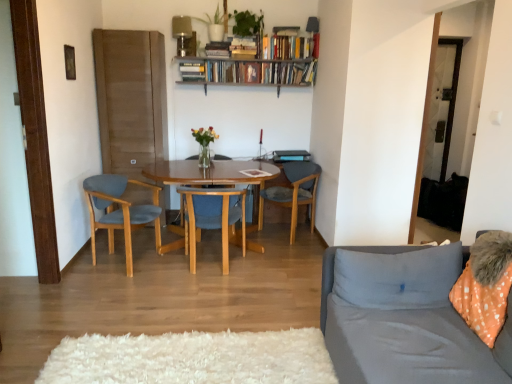
Describe the element at coordinates (397, 277) in the screenshot. The image size is (512, 384). I see `gray fabric pillow at right` at that location.

What do you see at coordinates (213, 217) in the screenshot?
I see `blue fabric chair at center, the second chair positioned from the left` at bounding box center [213, 217].

Describe the element at coordinates (215, 25) in the screenshot. I see `green matte plant at upper center, the first houseplant in the left-to-right sequence` at that location.

What do you see at coordinates (181, 32) in the screenshot? This screenshot has height=384, width=512. I see `metallic silver lamp at upper center, which is the 2th lamp from right to left` at bounding box center [181, 32].

The width and height of the screenshot is (512, 384). What do you see at coordinates (120, 211) in the screenshot?
I see `matte blue chair at left, the third chair in the right-to-left sequence` at bounding box center [120, 211].

Where is `hardcover books at upper center, which appears as the 1th book when viewed from the right`? Image resolution: width=512 pixels, height=384 pixels. hardcover books at upper center, which appears as the 1th book when viewed from the right is located at coordinates (287, 47).

Relative to gray fabric pillow at right, is green matte plant at upper center, the 1th houseplant when ordered from right to left, in front or behind?

Clearly, green matte plant at upper center, the 1th houseplant when ordered from right to left, is behind gray fabric pillow at right.

In the scene shown: From a real-world perspective, between green matte plant at upper center, the 2th houseplant positioned from the left, and gray fabric pillow at right, who is vertically lower?

gray fabric pillow at right, from a real-world perspective.

Considering the relative positions of green matte plant at upper center, the 2th houseplant positioned from the left, and gray fabric pillow at right in the image provided, is green matte plant at upper center, the 2th houseplant positioned from the left, to the left or to the right of gray fabric pillow at right?

green matte plant at upper center, the 2th houseplant positioned from the left, is to the left of gray fabric pillow at right.

Is point (247, 24) closer or farther from the camera than point (456, 278)?

Point (247, 24) appears to be farther away from the viewer than point (456, 278).

From a real-world perspective, is green matte plant at upper center, the first houseplant in the left-to-right sequence, positioned above or below metallic silver lamp at upper center, which is the 2th lamp from right to left?

Clearly, from a real-world perspective, green matte plant at upper center, the first houseplant in the left-to-right sequence, is above metallic silver lamp at upper center, which is the 2th lamp from right to left.

Is point (201, 19) less distant than point (183, 38)?

No, it is behind (183, 38).

Considering the relative sizes of green matte plant at upper center, the first houseplant in the left-to-right sequence, and metallic silver lamp at upper center, positioned as the first lamp in left-to-right order, in the image provided, is green matte plant at upper center, the first houseplant in the left-to-right sequence, smaller than metallic silver lamp at upper center, positioned as the first lamp in left-to-right order,?

Actually, green matte plant at upper center, the first houseplant in the left-to-right sequence, might be larger than metallic silver lamp at upper center, positioned as the first lamp in left-to-right order.

Based on the photo, who is taller, green matte plant at upper center, the first houseplant in the left-to-right sequence, or metallic silver lamp at upper center, which is the 2th lamp from right to left?

Standing taller between the two is metallic silver lamp at upper center, which is the 2th lamp from right to left.

Could you tell me if blue fabric chair at center, which is counted as the 2th chair, starting from the right, is turned towards hardcover books at upper center, placed as the 2th book when sorted from right to left?

No, blue fabric chair at center, which is counted as the 2th chair, starting from the right, is not facing towards hardcover books at upper center, placed as the 2th book when sorted from right to left.

This screenshot has height=384, width=512. Identify the location of the 3rd chair below the hardcover books at upper center, placed as the 2th book when sorted from right to left (from the image's perspective). 213,217.

Between point (197, 198) and point (276, 68), which one is positioned in front?

The point (197, 198) is in front.

In terms of height, does blue fabric chair at center, which is counted as the 2th chair, starting from the right, look taller or shorter compared to hardcover books at upper center, the 2th book positioned from the left?

In the image, blue fabric chair at center, which is counted as the 2th chair, starting from the right, appears to be taller than hardcover books at upper center, the 2th book positioned from the left.

Consider the image. How different are the orientations of gray fabric pillow at right and hardcover books at upper center, the 3th book when ordered from left to right, in degrees?

The facing directions of gray fabric pillow at right and hardcover books at upper center, the 3th book when ordered from left to right, are 1.66 degrees apart.

Can hardcover books at upper center, the 3th book when ordered from left to right, be found inside gray fabric pillow at right?

No, hardcover books at upper center, the 3th book when ordered from left to right, is located outside of gray fabric pillow at right.

Which object is closer to the camera, gray fabric pillow at right or hardcover books at upper center, the 3th book when ordered from left to right?

gray fabric pillow at right.

From the image's perspective, which object appears higher, gray fabric pillow at right or hardcover books at upper center, the 3th book when ordered from left to right?

hardcover books at upper center, the 3th book when ordered from left to right, from the image's perspective.

Considering the sizes of objects wooden chair at center, the third chair in the left-to-right sequence, and matte blue chair at left, acting as the first chair starting from the left, in the image provided, who is taller, wooden chair at center, the third chair in the left-to-right sequence, or matte blue chair at left, acting as the first chair starting from the left,?

Standing taller between the two is matte blue chair at left, acting as the first chair starting from the left.

Is wooden chair at center, the 1th chair positioned from the right, situated inside matte blue chair at left, acting as the first chair starting from the left, or outside?

wooden chair at center, the 1th chair positioned from the right, exists outside the volume of matte blue chair at left, acting as the first chair starting from the left.

In the scene shown: Is wooden chair at center, the 1th chair positioned from the right, directly adjacent to matte blue chair at left, the third chair in the right-to-left sequence?

No.

From their relative heights in the image, would you say blue fabric chair at center, which is counted as the 2th chair, starting from the right, is taller or shorter than green matte plant at upper center, which ranks as the second houseplant in right-to-left order?

In the image, blue fabric chair at center, which is counted as the 2th chair, starting from the right, appears to be taller than green matte plant at upper center, which ranks as the second houseplant in right-to-left order.

Which is more distant, [237,206] or [211,36]?

Positioned behind is point [237,206].

What are the coordinates of `the 3rd chair below when counting from the green matte plant at upper center, which ranks as the second houseplant in right-to-left order (from the image's perspective)` in the screenshot? It's located at (213, 217).

From a real-world perspective, is blue fabric chair at center, which is counted as the 2th chair, starting from the right, positioned above or below green matte plant at upper center, the first houseplant in the left-to-right sequence?

blue fabric chair at center, which is counted as the 2th chair, starting from the right, is situated lower than green matte plant at upper center, the first houseplant in the left-to-right sequence, in the real world.

Considering the sizes of green matte plant at upper center, the 1th houseplant when ordered from right to left, and blue fabric chair at center, the second chair positioned from the left, in the image, is green matte plant at upper center, the 1th houseplant when ordered from right to left, taller or shorter than blue fabric chair at center, the second chair positioned from the left,?

Considering their sizes, green matte plant at upper center, the 1th houseplant when ordered from right to left, has less height than blue fabric chair at center, the second chair positioned from the left.

Can you confirm if green matte plant at upper center, the 2th houseplant positioned from the left, is wider than blue fabric chair at center, the second chair positioned from the left?

Incorrect, the width of green matte plant at upper center, the 2th houseplant positioned from the left, does not surpass that of blue fabric chair at center, the second chair positioned from the left.

Is green matte plant at upper center, the 2th houseplant positioned from the left, oriented towards blue fabric chair at center, the second chair positioned from the left?

No, green matte plant at upper center, the 2th houseplant positioned from the left, is not turned towards blue fabric chair at center, the second chair positioned from the left.

How different are the orientations of green matte plant at upper center, the 2th houseplant positioned from the left, and blue fabric chair at center, which is counted as the 2th chair, starting from the right, in degrees?

The angular difference between green matte plant at upper center, the 2th houseplant positioned from the left, and blue fabric chair at center, which is counted as the 2th chair, starting from the right, is 172 degrees.

Where is `pillow on the right of green matte plant at upper center, the 2th houseplant positioned from the left`? This screenshot has width=512, height=384. pillow on the right of green matte plant at upper center, the 2th houseplant positioned from the left is located at coordinates [x=397, y=277].

From a real-world perspective, starting from the green matte plant at upper center, the first houseplant in the left-to-right sequence, which lamp is the 2nd one below it? Please provide its 2D coordinates.

[(181, 32)]

Estimate the real-world distances between objects in this image. Which object is closer to gray fabric pillow at right, metallic silver lamp at upper center, which is the 2th lamp from right to left, or hardcover books at upper center, which appears as the 1th book when viewed from the right?

Among the two, hardcover books at upper center, which appears as the 1th book when viewed from the right, is located nearer to gray fabric pillow at right.

Estimate the real-world distances between objects in this image. Which object is closer to wooden chair at center, the 1th chair positioned from the right, blue fabric chair at center, which is counted as the 2th chair, starting from the right, or gray fabric pillow at right?

blue fabric chair at center, which is counted as the 2th chair, starting from the right.

Estimate the real-world distances between objects in this image. Which object is further from matte blue chair at left, the third chair in the right-to-left sequence, metallic silver lamp at upper center, which is the 2th lamp from right to left, or hardcover books at upper center, placed as the 2th book when sorted from right to left?

metallic silver lamp at upper center, which is the 2th lamp from right to left, is further to matte blue chair at left, the third chair in the right-to-left sequence.

Estimate the real-world distances between objects in this image. Which object is further from gray fabric couch at right, hardcover books at upper center, the 2th book positioned from the left, or hardcover book at upper center, which is the first book in left-to-right order?

Among the two, hardcover book at upper center, which is the first book in left-to-right order, is located further to gray fabric couch at right.

From the image, which object appears to be farther from metallic silver lamp at upper center, which is the 2th lamp from right to left, wooden chair at center, the 1th chair positioned from the right, or gray fabric couch at right?

gray fabric couch at right is positioned further to the anchor metallic silver lamp at upper center, which is the 2th lamp from right to left.

Based on their spatial positions, is green matte plant at upper center, the first houseplant in the left-to-right sequence, or wooden chair at center, the 1th chair positioned from the right, further from hardcover books at upper center, the 3th book when ordered from left to right?

wooden chair at center, the 1th chair positioned from the right, is further to hardcover books at upper center, the 3th book when ordered from left to right.

Which object lies nearer to the anchor point hardcover book at upper center, which is the first book in left-to-right order, gray fabric couch at right or wooden chair at center, the third chair in the left-to-right sequence?

The object closer to hardcover book at upper center, which is the first book in left-to-right order, is wooden chair at center, the third chair in the left-to-right sequence.

From the image, which object appears to be nearer to hardcover book at upper center, which is the first book in left-to-right order, matte blue chair at left, acting as the first chair starting from the left, or matte black lampshade at upper center, which ranks as the first lamp in right-to-left order?

The object closer to hardcover book at upper center, which is the first book in left-to-right order, is matte black lampshade at upper center, which ranks as the first lamp in right-to-left order.

What are the coordinates of `chair between matte black lampshade at upper center, marked as the second lamp in a left-to-right arrangement, and matte blue chair at left, the third chair in the right-to-left sequence, vertically` in the screenshot? It's located at (292, 192).

Where is `pillow located between gray fabric couch at right and wooden chair at center, the 1th chair positioned from the right, in the depth direction`? The width and height of the screenshot is (512, 384). pillow located between gray fabric couch at right and wooden chair at center, the 1th chair positioned from the right, in the depth direction is located at coordinates (397, 277).

Locate an element on the screen. The image size is (512, 384). houseplant that lies between green matte plant at upper center, the first houseplant in the left-to-right sequence, and matte blue chair at left, the third chair in the right-to-left sequence, from top to bottom is located at coordinates click(247, 23).

The height and width of the screenshot is (384, 512). Identify the location of houseplant between green matte plant at upper center, the first houseplant in the left-to-right sequence, and gray fabric pillow at right from top to bottom. (247, 23).